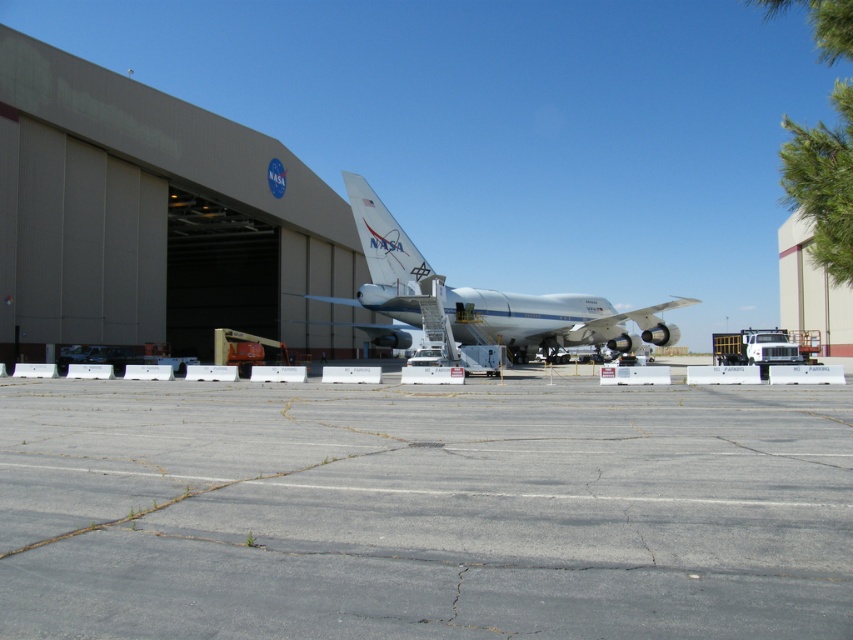
Between gray asphalt tarmac at center and white metallic airplane at center, which one appears on the right side from the viewer's perspective?

Positioned to the right is gray asphalt tarmac at center.

Does point (137, 492) lie behind point (483, 339)?

No, it is in front of (483, 339).

Image resolution: width=853 pixels, height=640 pixels. What do you see at coordinates (424, 509) in the screenshot?
I see `gray asphalt tarmac at center` at bounding box center [424, 509].

Find the location of `gray asphalt tarmac at center`. gray asphalt tarmac at center is located at coordinates (424, 509).